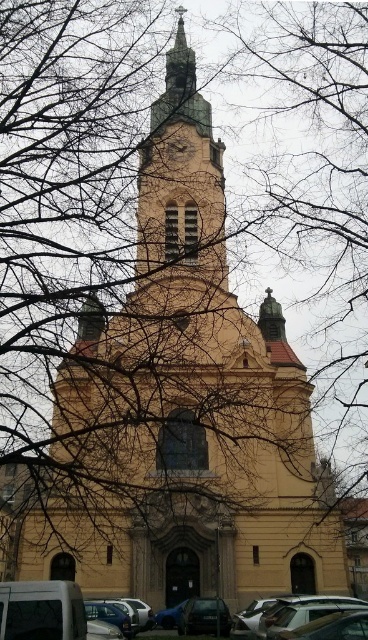
You are standing at the center of the image and want to locate the metallic silver car at lower right. According to the coordinate system where the bottom left corner is the origin, what direction should you look to find it?

The metallic silver car at lower right is located at coordinate point 0.964 on the x axis and 0.332 on the y axis. Since the bottom left corner is the origin, you should look to the far right and slightly upward from the bottom to locate it.